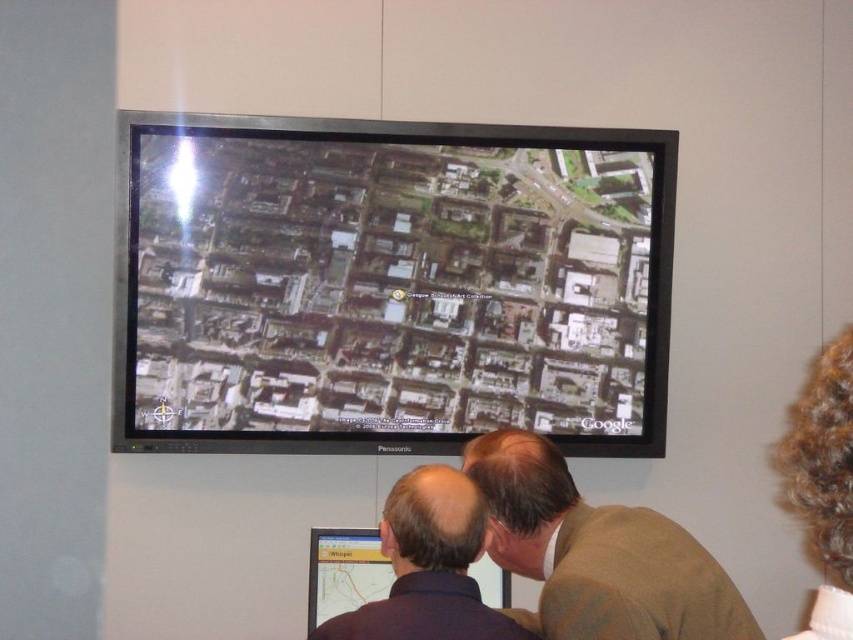
Question: Which object is closer to the camera taking this photo?

Choices:
 (A) brown hair at lower center
 (B) dark blue shirt at lower center
 (C) satellite map at center

Answer: (B)

Question: Is brown wool sweater at lower right positioned before brown hair at lower center?

Choices:
 (A) yes
 (B) no

Answer: (A)

Question: Which of the following is the closest to the observer?

Choices:
 (A) brown hair at lower center
 (B) dark blue shirt at lower center

Answer: (B)

Question: Is brown hair at lower center bigger than dark blue shirt at lower center?

Choices:
 (A) no
 (B) yes

Answer: (B)

Question: Estimate the real-world distances between objects in this image. Which object is farther from the brown hair at lower center?

Choices:
 (A) satellite map at center
 (B) dark blue shirt at lower center

Answer: (A)

Question: Does satellite map at center have a lesser width compared to dark blue shirt at lower center?

Choices:
 (A) yes
 (B) no

Answer: (B)